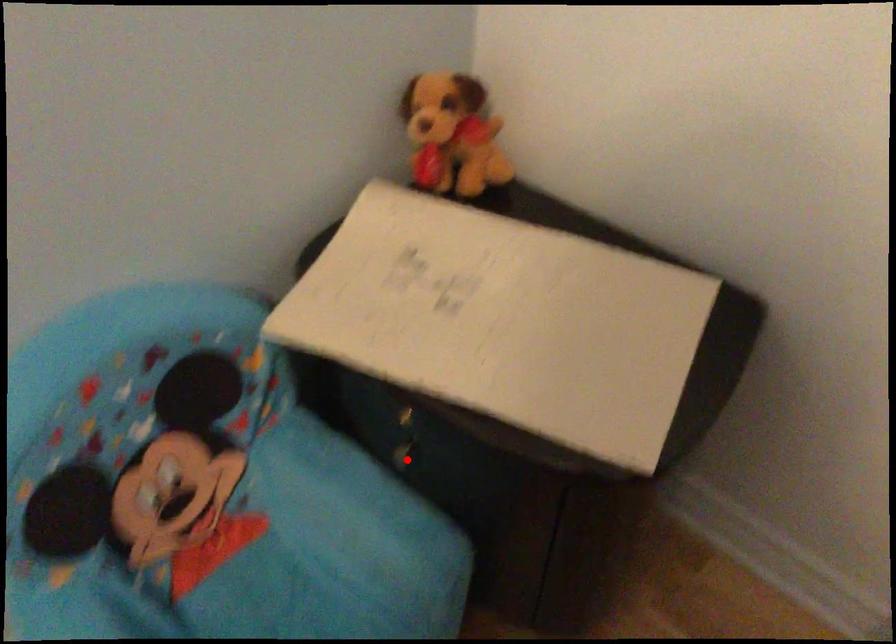
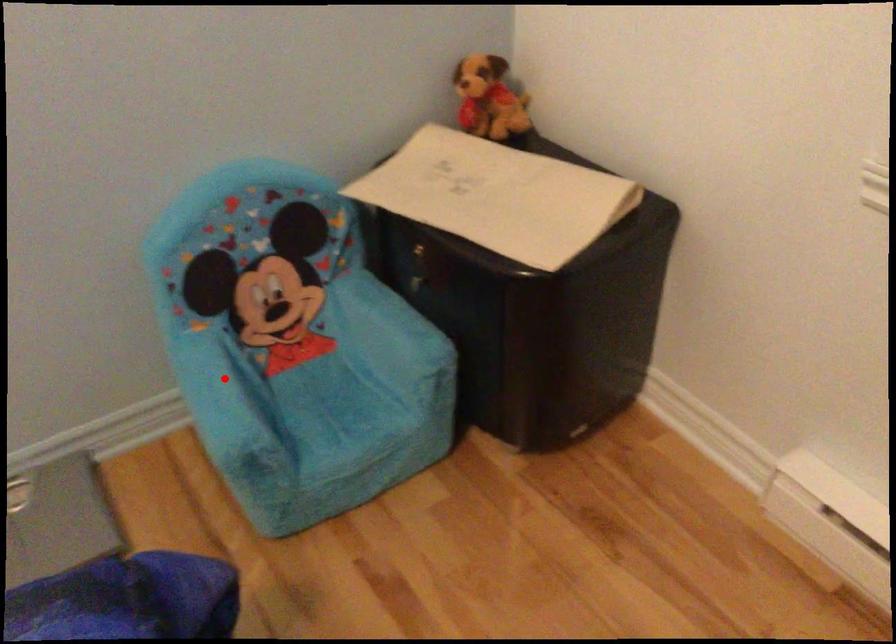
I am providing you with two images of the same scene from different viewpoints. A red point is marked on the first image and another point is marked on the second image. Do the highlighted points in image1 and image2 indicate the same real-world spot?

No